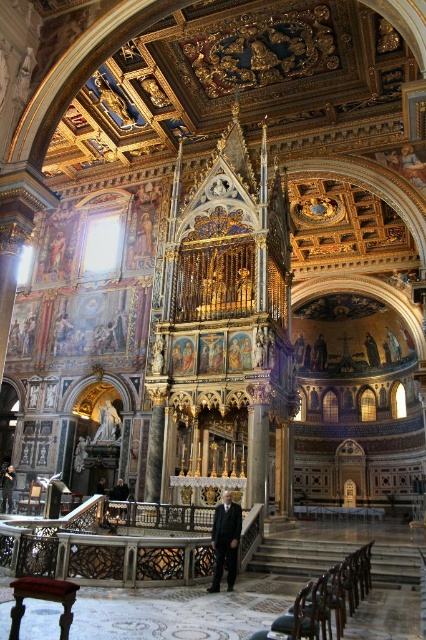
Can you confirm if black suit at center is positioned to the right of dark suit at center?

Correct, you'll find black suit at center to the right of dark suit at center.

Does black suit at center have a smaller size compared to dark suit at center?

No, black suit at center is not smaller than dark suit at center.

Measure the distance between point (215, 557) and camera.

Point (215, 557) and camera are 39.90 meters apart from each other.

Locate an element on the screen. Image resolution: width=426 pixels, height=640 pixels. black suit at center is located at coordinates (226, 541).